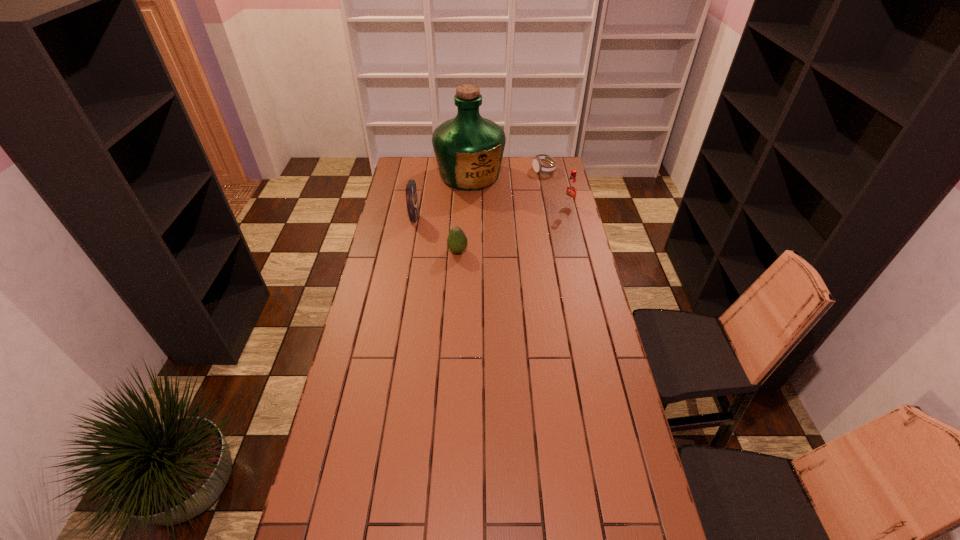
Identify the location of object present at the left edge. (411, 190).

You are a GUI agent. You are given a task and a screenshot of the screen. Output one action in this format:
    pyautogui.click(x=<x>, y=<y>)
    Task: Click on the root beer positioned at the right edge
    
    Given the screenshot: What is the action you would take?
    pyautogui.click(x=570, y=191)

Where is `watch located in the right edge section of the desktop`? The height and width of the screenshot is (540, 960). watch located in the right edge section of the desktop is located at coordinates (538, 166).

Locate an element on the screen. object positioned at the far right corner is located at coordinates (538, 166).

I want to click on vacant region at the far edge of the desktop, so tap(516, 175).

The width and height of the screenshot is (960, 540). In order to click on vacant space at the left edge in this screenshot , I will do `click(386, 312)`.

The image size is (960, 540). In the image, there is a desktop. Identify the location of vacant space at the right edge. (610, 372).

In the image, there is a desktop. Identify the location of vacant space at the far left corner. (418, 166).

Find the location of a particular element. This screenshot has height=540, width=960. vacant space at the near left corner of the desktop is located at coordinates (322, 534).

Identify the location of empty space between the leftmost object and the root beer. The width and height of the screenshot is (960, 540). (492, 213).